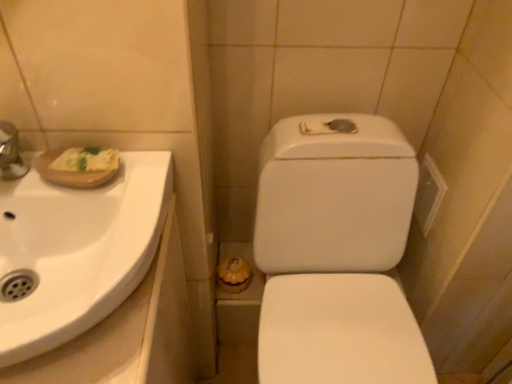
Where is `white glossy sink at upper left`? Image resolution: width=512 pixels, height=384 pixels. white glossy sink at upper left is located at coordinates (75, 251).

The image size is (512, 384). What do you see at coordinates (75, 251) in the screenshot?
I see `white glossy sink at upper left` at bounding box center [75, 251].

Measure the distance between point (288, 159) and camera.

33.86 inches.

In the scene shown: In order to face white glossy toilet at center, should I rotate leftwards or rightwards?

Rotate your view right by about 10.491°.

What do you see at coordinates (336, 253) in the screenshot? Image resolution: width=512 pixels, height=384 pixels. I see `white glossy toilet at center` at bounding box center [336, 253].

Where is `white glossy toilet at center`? The image size is (512, 384). white glossy toilet at center is located at coordinates (336, 253).

Locate an element on the screen. white glossy sink at upper left is located at coordinates (75, 251).

Considering the positions of objects white glossy sink at upper left and white glossy toilet at center in the image provided, who is more to the left, white glossy sink at upper left or white glossy toilet at center?

From the viewer's perspective, white glossy sink at upper left appears more on the left side.

Is white glossy sink at upper left further to camera compared to white glossy toilet at center?

No, white glossy sink at upper left is in front of white glossy toilet at center.

Is point (134, 234) in front of point (402, 141)?

That is True.

From the image's perspective, is white glossy sink at upper left above or below white glossy toilet at center?

Clearly, from the image's perspective, white glossy sink at upper left is above white glossy toilet at center.

From a real-world perspective, is white glossy sink at upper left positioned over white glossy toilet at center based on gravity?

Yes, from a real-world perspective, white glossy sink at upper left is on top of white glossy toilet at center.

Considering the sizes of objects white glossy sink at upper left and white glossy toilet at center in the image provided, who is thinner, white glossy sink at upper left or white glossy toilet at center?

Thinner between the two is white glossy sink at upper left.

Between white glossy sink at upper left and white glossy toilet at center, which one has less height?

white glossy sink at upper left is shorter.

Which of these two, white glossy sink at upper left or white glossy toilet at center, is smaller?

white glossy sink at upper left is smaller.

Would you say white glossy sink at upper left contains white glossy toilet at center?

No, white glossy toilet at center is not surrounded by white glossy sink at upper left.

Is white glossy sink at upper left directly adjacent to white glossy toilet at center?

white glossy sink at upper left and white glossy toilet at center are not in contact.

Could you tell me if white glossy sink at upper left is facing white glossy toilet at center?

No.

Can you tell me how much white glossy sink at upper left and white glossy toilet at center differ in facing direction?

1.29 degrees.

Identify the location of sink located above the white glossy toilet at center (from the image's perspective). This screenshot has width=512, height=384. (75, 251).

Which is more to the left, white glossy toilet at center or white glossy sink at upper left?

Positioned to the left is white glossy sink at upper left.

Which object is further away from the camera taking this photo, white glossy toilet at center or white glossy sink at upper left?

white glossy toilet at center.

Which point is more forward, [260,352] or [87,311]?

The point [87,311] is in front.

From the image's perspective, who appears lower, white glossy toilet at center or white glossy sink at upper left?

white glossy toilet at center is shown below in the image.

From a real-world perspective, who is located lower, white glossy toilet at center or white glossy sink at upper left?

white glossy toilet at center is physically lower.

From the picture: Does white glossy toilet at center have a lesser width compared to white glossy sink at upper left?

No.

In terms of height, does white glossy toilet at center look taller or shorter compared to white glossy sink at upper left?

In the image, white glossy toilet at center appears to be taller than white glossy sink at upper left.

Considering the sizes of objects white glossy toilet at center and white glossy sink at upper left in the image provided, who is smaller, white glossy toilet at center or white glossy sink at upper left?

white glossy sink at upper left.

Would you say white glossy toilet at center is inside or outside white glossy sink at upper left?

white glossy toilet at center is spatially situated outside white glossy sink at upper left.

Can you see white glossy toilet at center touching white glossy sink at upper left?

white glossy toilet at center and white glossy sink at upper left are clearly separated.

Is white glossy toilet at center aimed at white glossy sink at upper left?

No, white glossy toilet at center is not oriented towards white glossy sink at upper left.

Can you tell me how much white glossy toilet at center and white glossy sink at upper left differ in facing direction?

1.29 degrees separate the facing orientations of white glossy toilet at center and white glossy sink at upper left.

Where is `toilet that is behind the white glossy sink at upper left`? This screenshot has height=384, width=512. toilet that is behind the white glossy sink at upper left is located at coordinates (336, 253).

Where is `sink above the white glossy toilet at center (from a real-world perspective)`? This screenshot has width=512, height=384. sink above the white glossy toilet at center (from a real-world perspective) is located at coordinates (75, 251).

Where is `toilet lying below the white glossy sink at upper left (from the image's perspective)`? Image resolution: width=512 pixels, height=384 pixels. toilet lying below the white glossy sink at upper left (from the image's perspective) is located at coordinates (336, 253).